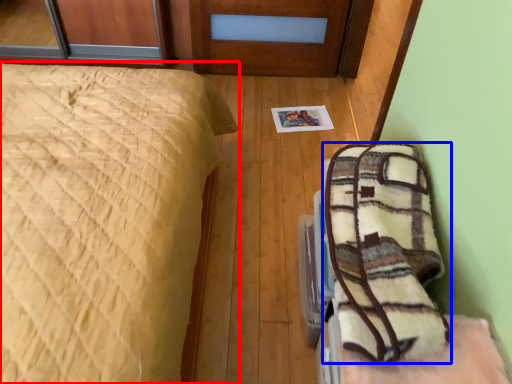
Question: Which of the following is the closest to the observer, bed (highlighted by a red box) or blanket (highlighted by a blue box)?

Choices:
 (A) bed
 (B) blanket

Answer: (A)